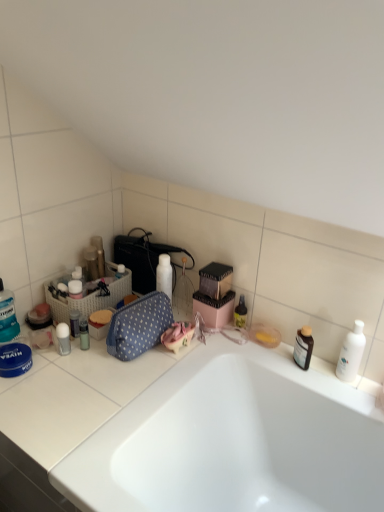
The width and height of the screenshot is (384, 512). What are the coordinates of `free space to the right of translucent plastic tube at left, which appears as the 8th toiletry when viewed from the right` in the screenshot? It's located at (x=115, y=356).